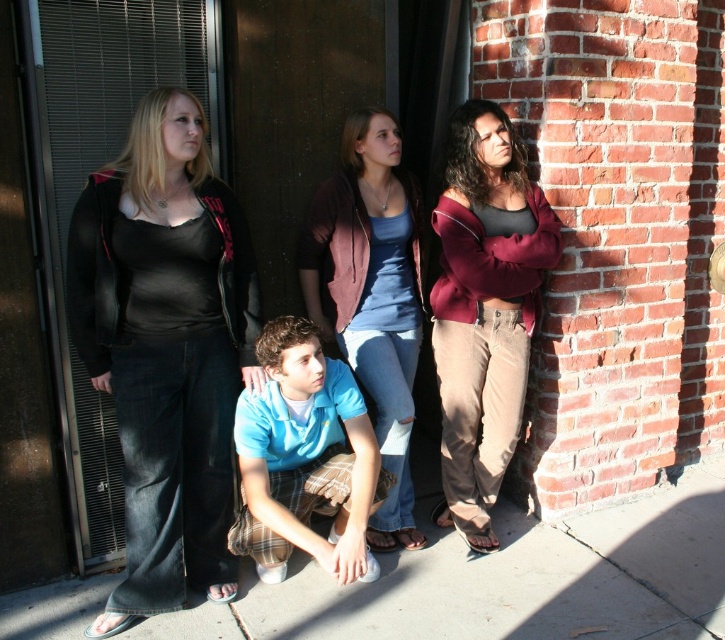
You are a photographer trying to capture a candid shot of the matte black top at center and the maroon fleece jacket at right. Based on their positions, which one is closer to the ground?

The matte black top at center is closer to the ground because it is positioned below the maroon fleece jacket at right.